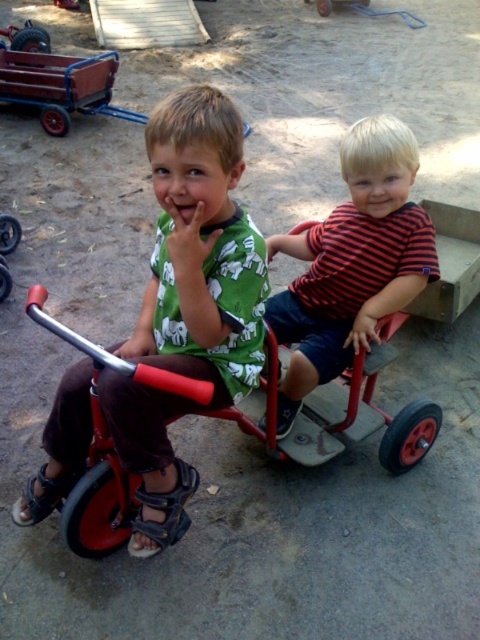
Question: Can you confirm if green matte shirt at center is wider than striped cotton shirt at center?

Choices:
 (A) yes
 (B) no

Answer: (A)

Question: Which object appears closest to the camera in this image?

Choices:
 (A) green matte shirt at center
 (B) striped cotton shirt at center

Answer: (A)

Question: Which point appears farthest from the camera in this image?

Choices:
 (A) (75, 508)
 (B) (231, 388)
 (C) (410, 294)

Answer: (C)

Question: Is striped cotton shirt at center wider than metallic red tricycle at center?

Choices:
 (A) no
 (B) yes

Answer: (A)

Question: Based on their relative distances, which object is farther from the metallic red tricycle at center?

Choices:
 (A) green matte shirt at center
 (B) striped cotton shirt at center

Answer: (B)

Question: Can you confirm if striped cotton shirt at center is smaller than metallic red tricycle at center?

Choices:
 (A) yes
 (B) no

Answer: (A)